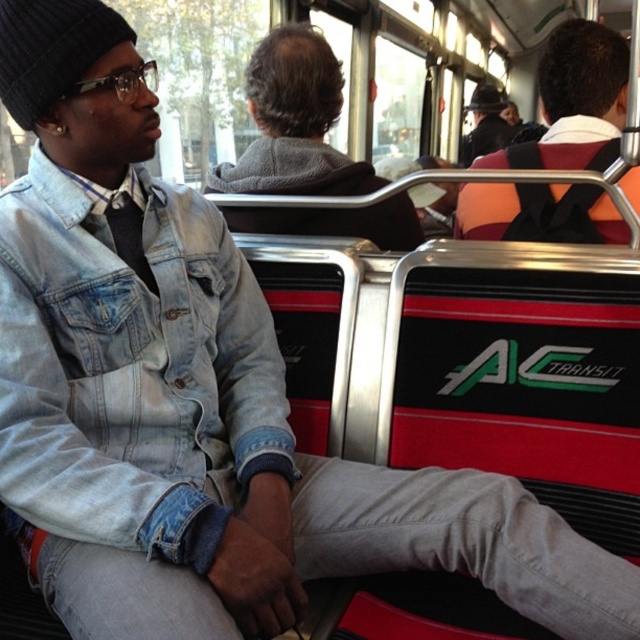
You are a passenger on the AC Transit bus and want to reach the black knit hat at upper center without disturbing the person wearing the faded denim jacket at lower right. Is this possible?

The faded denim jacket at lower right is closer to the viewer than the black knit hat at upper center, so the faded denim jacket at lower right is blocking the path to the black knit hat at upper center. Therefore, you would need to move around the faded denim jacket at lower right to access the black knit hat at upper center without disturbing the person wearing it.

You are a bus passenger who needs to reach your destination. You are currently sitting on the left side of the bus and see the faded denim jacket at lower right and the orange fabric backpack at upper right. Which item is closer to you?

The faded denim jacket at lower right is closer to you since it is only 3.43 feet away from the orange fabric backpack at upper right, but since you are sitting on the left side, the faded denim jacket at lower right would be nearer compared to the backpack which is placed higher up.

You are a passenger on the AC Transit bus and you see the orange fabric backpack at upper right and the black knit beanie at upper left. Which object is located lower in the image?

The orange fabric backpack at upper right is positioned under the black knit beanie at upper left, so it is located lower in the image.